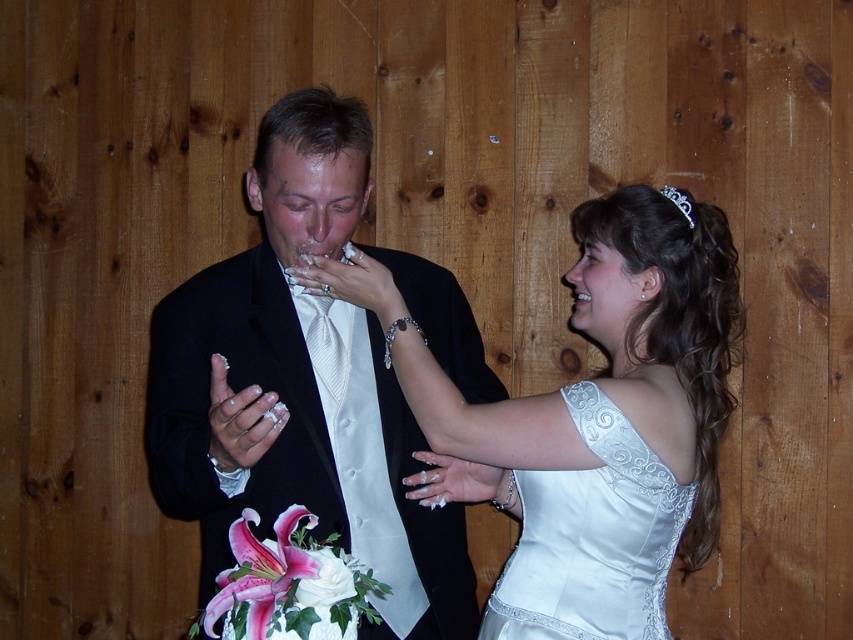
You are a photographer at the wedding and need to adjust the lighting to highlight the matte black suit at center. Where should you position the light source relative to the camera to ensure the suit is well lit?

To highlight the matte black suit at center, position the light source directly in front of the camera, at coordinates approximately 0.606 on the x and 0.352 on the y axis, where the suit is located.

You are a photographer at the wedding and want to take a closeup shot of the bride. The bride is standing at the center. There is a point marked at coordinate [299,387] which is the location of the matte black suit at center. Where should you position yourself relative to this point to capture the bride?

The point at [299,387] is where the matte black suit at center is located. Since the bride is standing at the center, you should position yourself directly in front of this point to capture the bride.